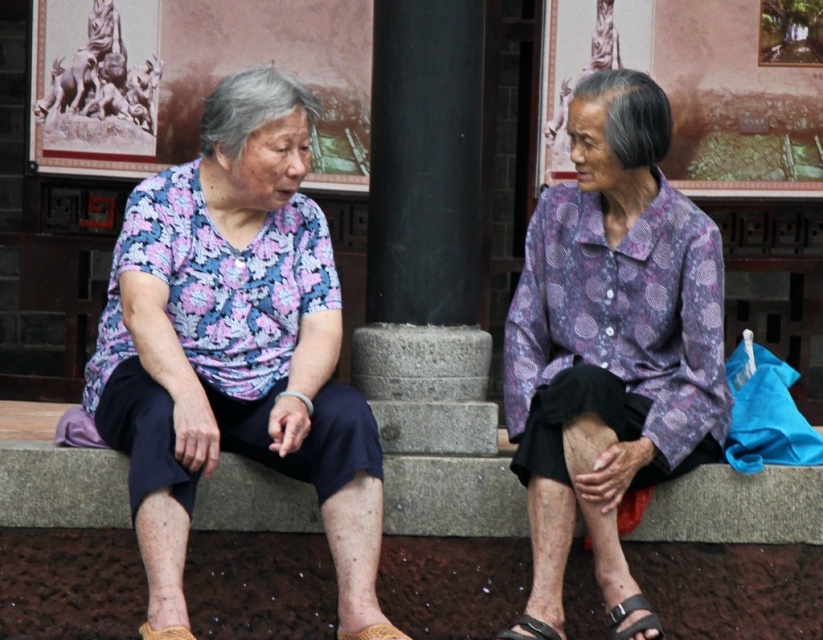
Is black leather sandal at lower right to the left of brown leather sandal at lower center from the viewer's perspective?

In fact, black leather sandal at lower right is to the right of brown leather sandal at lower center.

You are a GUI agent. You are given a task and a screenshot of the screen. Output one action in this format:
    pyautogui.click(x=<x>, y=<y>)
    Task: Click on the black leather sandal at lower right
    
    Given the screenshot: What is the action you would take?
    pyautogui.click(x=635, y=620)

What are the coordinates of `black leather sandal at lower right` in the screenshot? It's located at (635, 620).

Find the location of a particular element. black leather sandal at lower right is located at coordinates (635, 620).

Is printed fabric blouse at left closer to the viewer compared to black leather sandal at lower center?

That is True.

Between point (205, 154) and point (505, 634), which one is positioned in front?

Point (505, 634)

Which is in front, point (159, 268) or point (508, 630)?

Point (508, 630)

Where is `printed fabric blouse at left`? The image size is (823, 640). printed fabric blouse at left is located at coordinates (235, 342).

Who is more forward, (644, 604) or (540, 636)?

Point (540, 636) is more forward.

Is black leather sandal at lower right below black leather sandal at lower center?

No.

The height and width of the screenshot is (640, 823). What are the coordinates of `black leather sandal at lower right` in the screenshot? It's located at (635, 620).

This screenshot has width=823, height=640. Identify the location of black leather sandal at lower right. (635, 620).